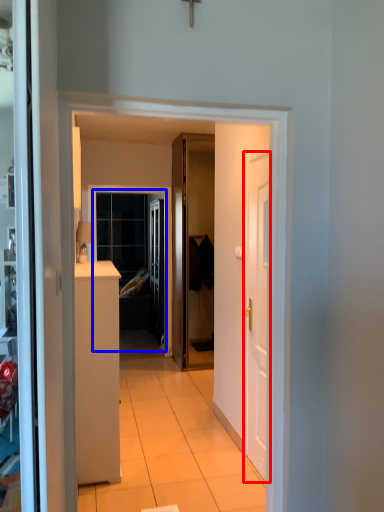
Question: Which point is further to the camera, door (highlighted by a red box) or window (highlighted by a blue box)?

Choices:
 (A) door
 (B) window

Answer: (B)